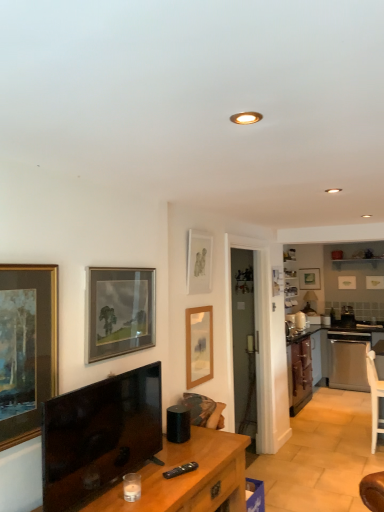
What do you see at coordinates (178, 423) in the screenshot?
I see `black matte speaker at center, placed as the second appliance when sorted from back to front` at bounding box center [178, 423].

This screenshot has height=512, width=384. What do you see at coordinates (118, 311) in the screenshot?
I see `matte glass picture frame at upper left, which is the 6th picture frame from right to left` at bounding box center [118, 311].

Locate an element on the screen. The image size is (384, 512). matte wooden picture frame at upper right, the 7th picture frame in the front-to-back sequence is located at coordinates (309, 279).

Image resolution: width=384 pixels, height=512 pixels. What are the coordinates of `satin silver dishwasher at lower right` in the screenshot? It's located at (348, 360).

Can you confirm if matte white picture frame at upper center, the fourth picture frame positioned from the back, is wider than wooden picture frame at center, which appears as the fifth picture frame when viewed from the back?

Incorrect, the width of matte white picture frame at upper center, the fourth picture frame positioned from the back, does not surpass that of wooden picture frame at center, which appears as the fifth picture frame when viewed from the back.

Which of these two, matte white picture frame at upper center, the fourth picture frame positioned from the right, or wooden picture frame at center, which appears as the fifth picture frame when viewed from the back, is bigger?

wooden picture frame at center, which appears as the fifth picture frame when viewed from the back.

Is matte white picture frame at upper center, the fourth picture frame positioned from the right, placed right next to wooden picture frame at center, which is the 3th picture frame from front to back?

No, matte white picture frame at upper center, the fourth picture frame positioned from the right, is not with wooden picture frame at center, which is the 3th picture frame from front to back.

Could you tell me if matte white picture frame at upper center, the fourth picture frame positioned from the back, is turned towards wooden picture frame at center, which is the 3th picture frame from front to back?

No, matte white picture frame at upper center, the fourth picture frame positioned from the back, is not turned towards wooden picture frame at center, which is the 3th picture frame from front to back.

From the image's perspective, relative to matte gold picture frame at upper right, positioned as the second picture frame in right-to-left order, is wooden picture frame at center, which is the 3th picture frame from front to back, above or below?

Based on their image positions, wooden picture frame at center, which is the 3th picture frame from front to back, is located beneath matte gold picture frame at upper right, positioned as the second picture frame in right-to-left order.

How different are the orientations of wooden picture frame at center, which appears as the fifth picture frame when viewed from the back, and matte gold picture frame at upper right, positioned as the 6th picture frame in front-to-back order, in degrees?

89.8 degrees.

Considering the relative sizes of wooden picture frame at center, which appears as the fifth picture frame when viewed from the back, and matte gold picture frame at upper right, the sixth picture frame in the left-to-right sequence, in the image provided, is wooden picture frame at center, which appears as the fifth picture frame when viewed from the back, shorter than matte gold picture frame at upper right, the sixth picture frame in the left-to-right sequence,?

In fact, wooden picture frame at center, which appears as the fifth picture frame when viewed from the back, may be taller than matte gold picture frame at upper right, the sixth picture frame in the left-to-right sequence.

Which picture frame is the 3rd one when counting from the left side of the matte gold picture frame at upper right, marked as the second picture frame in a back-to-front arrangement? Please provide its 2D coordinates.

[(199, 345)]

From a real-world perspective, starting from the white glossy toaster at upper right, the 1th appliance from the right, which picture frame is the 5th one vertically above it? Please provide its 2D coordinates.

[(374, 282)]

Choose the correct answer: Is matte gold picture frame at upper right, placed as the 7th picture frame when sorted from left to right, inside white glossy toaster at upper right, the 2th appliance in the front-to-back sequence, or outside it?

matte gold picture frame at upper right, placed as the 7th picture frame when sorted from left to right, is spatially situated outside white glossy toaster at upper right, the 2th appliance in the front-to-back sequence.

Is matte gold picture frame at upper right, which is the third picture frame in back-to-front order, to the left of white glossy toaster at upper right, the second appliance when ordered from left to right, from the viewer's perspective?

In fact, matte gold picture frame at upper right, which is the third picture frame in back-to-front order, is to the right of white glossy toaster at upper right, the second appliance when ordered from left to right.

Is white wooden chair at lower right facing towards wooden picture frame at left, which ranks as the 7th picture frame in right-to-left order?

No.

Considering the points (378, 425) and (21, 298), which point is in front, point (378, 425) or point (21, 298)?

Positioned in front is point (21, 298).

Considering the relative positions of white wooden chair at lower right and wooden picture frame at left, marked as the seventh picture frame in a back-to-front arrangement, in the image provided, is white wooden chair at lower right to the left of wooden picture frame at left, marked as the seventh picture frame in a back-to-front arrangement, from the viewer's perspective?

No, white wooden chair at lower right is not to the left of wooden picture frame at left, marked as the seventh picture frame in a back-to-front arrangement.

Would you say satin silver dishwasher at lower right is a long distance from white wooden chair at lower right?

satin silver dishwasher at lower right is far away from white wooden chair at lower right.

Who is shorter, satin silver dishwasher at lower right or white wooden chair at lower right?

satin silver dishwasher at lower right is shorter.

Is white wooden chair at lower right at the back of satin silver dishwasher at lower right?

That's not correct — satin silver dishwasher at lower right is not looking away from white wooden chair at lower right.

How many degrees apart are the facing directions of satin silver dishwasher at lower right and white wooden chair at lower right?

The facing directions of satin silver dishwasher at lower right and white wooden chair at lower right are 92.2 degrees apart.

Is black matte speaker at center, positioned as the first appliance in front-to-back order, looking in the opposite direction of matte gold picture frame at upper right, marked as the second picture frame in a back-to-front arrangement?

No.

From a real-world perspective, is black matte speaker at center, which is the 2th appliance in right-to-left order, above or below matte gold picture frame at upper right, the sixth picture frame in the left-to-right sequence?

Clearly, from a real-world perspective, black matte speaker at center, which is the 2th appliance in right-to-left order, is below matte gold picture frame at upper right, the sixth picture frame in the left-to-right sequence.

In terms of width, does black matte speaker at center, the 1th appliance when ordered from left to right, look wider or thinner when compared to matte gold picture frame at upper right, the sixth picture frame in the left-to-right sequence?

black matte speaker at center, the 1th appliance when ordered from left to right, is wider than matte gold picture frame at upper right, the sixth picture frame in the left-to-right sequence.

Is wooden picture frame at center, marked as the third picture frame in a left-to-right arrangement, facing towards satin silver dishwasher at lower right?

No, wooden picture frame at center, marked as the third picture frame in a left-to-right arrangement, does not turn towards satin silver dishwasher at lower right.

At what (x,y) coordinates should I click in order to perform the action: click on dish washer located below the wooden picture frame at center, which is the 3th picture frame from front to back (from the image's perspective). Please return your answer as a coordinate pair (x, y). Looking at the image, I should click on (348, 360).

Is point (202, 312) positioned after point (332, 345)?

No, (202, 312) is closer to viewer.

From the image's perspective, starting from the wooden picture frame at center, which appears as the fifth picture frame when viewed from the back, which picture frame is the 6th one above? Please provide its 2D coordinates.

[(199, 263)]

From a real-world perspective, which picture frame is the 3rd one underneath the matte gold picture frame at upper right, positioned as the second picture frame in right-to-left order? Please provide its 2D coordinates.

[(199, 345)]

Which object lies further to the anchor point wooden picture frame at center, marked as the third picture frame in a left-to-right arrangement, matte white picture frame at upper center, the fourth picture frame positioned from the right, or black matte speaker at center, the 1th appliance when ordered from left to right?

black matte speaker at center, the 1th appliance when ordered from left to right, is positioned further to the anchor wooden picture frame at center, marked as the third picture frame in a left-to-right arrangement.

Estimate the real-world distances between objects in this image. Which object is closer to wooden desk at center, white glossy toaster at upper right, the second appliance when ordered from left to right, or white glossy shelf at upper right?

white glossy toaster at upper right, the second appliance when ordered from left to right, is positioned closer to the anchor wooden desk at center.

Looking at the image, which one is located further to matte gold picture frame at upper right, the sixth picture frame in the left-to-right sequence, satin silver dishwasher at lower right or matte white picture frame at upper center, the fourth picture frame positioned from the back?

matte white picture frame at upper center, the fourth picture frame positioned from the back, is positioned further to the anchor matte gold picture frame at upper right, the sixth picture frame in the left-to-right sequence.

When comparing their distances from wooden picture frame at center, marked as the third picture frame in a left-to-right arrangement, does wooden picture frame at left, which is the first picture frame in front-to-back order, or black matte speaker at center, the 1th appliance when ordered from left to right, seem further?

The object further to wooden picture frame at center, marked as the third picture frame in a left-to-right arrangement, is wooden picture frame at left, which is the first picture frame in front-to-back order.

Which object lies further to the anchor point wooden picture frame at center, marked as the third picture frame in a left-to-right arrangement, satin silver dishwasher at lower right or black glossy television at lower left?

satin silver dishwasher at lower right lies further to wooden picture frame at center, marked as the third picture frame in a left-to-right arrangement, than the other object.

When comparing their distances from black matte speaker at center, placed as the second appliance when sorted from back to front, does white glossy shelf at upper right or white glossy toaster at upper right, the 2th appliance in the front-to-back sequence, seem closer?

white glossy toaster at upper right, the 2th appliance in the front-to-back sequence, is positioned closer to the anchor black matte speaker at center, placed as the second appliance when sorted from back to front.

When comparing their distances from white glossy toaster at upper right, the 2th appliance in the front-to-back sequence, does black matte speaker at center, placed as the second appliance when sorted from back to front, or white wooden chair at lower right seem further?

The object further to white glossy toaster at upper right, the 2th appliance in the front-to-back sequence, is black matte speaker at center, placed as the second appliance when sorted from back to front.

From the image, which object appears to be farther from black glossy television at lower left, white glossy shelf at upper right or wooden picture frame at center, which appears as the fifth picture frame when viewed from the back?

The object further to black glossy television at lower left is white glossy shelf at upper right.

This screenshot has height=512, width=384. What are the coordinates of `picture frame located between matte wooden picture frame at upper right, the 7th picture frame in the front-to-back sequence, and matte gold picture frame at upper right, placed as the 7th picture frame when sorted from left to right, in the left-right direction` in the screenshot? It's located at (346, 282).

The height and width of the screenshot is (512, 384). I want to click on dish washer between black matte speaker at center, positioned as the first appliance in front-to-back order, and matte gold picture frame at upper right, marked as the second picture frame in a back-to-front arrangement, from front to back, so click(348, 360).

Where is `cabinetry between white wooden chair at lower right and white glossy shelf at upper right along the z-axis`? The image size is (384, 512). cabinetry between white wooden chair at lower right and white glossy shelf at upper right along the z-axis is located at coordinates (302, 368).

The image size is (384, 512). I want to click on dish washer located between matte white picture frame at upper center, the fourth picture frame positioned from the back, and white glossy toaster at upper right, the 1th appliance from the right, in the depth direction, so click(x=348, y=360).